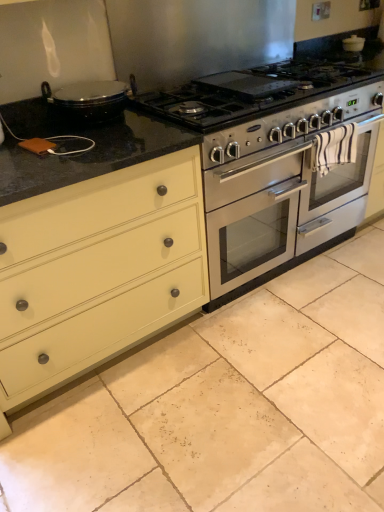
Where is `stainless steel oven at center`? This screenshot has height=512, width=384. stainless steel oven at center is located at coordinates (281, 208).

Measure the distance between matte cream drawer at left and camera.

They are 1.22 meters apart.

The width and height of the screenshot is (384, 512). What are the coordinates of `beige matte tile at center` in the screenshot? It's located at (227, 406).

Is matte cream drawer at left looking in the opposite direction of satin silver gas stove at center?

No, satin silver gas stove at center is not at the back of matte cream drawer at left.

Considering the points (21, 304) and (321, 91), which point is in front, point (21, 304) or point (321, 91)?

The point (21, 304) is in front.

From a real-world perspective, which object stands above the other?

satin silver gas stove at center.

Choose the correct answer: Is matte cream drawer at left inside satin silver gas stove at center or outside it?

matte cream drawer at left exists outside the volume of satin silver gas stove at center.

From the image's perspective, is satin silver gas stove at center above or below beige matte tile at center?

satin silver gas stove at center is above beige matte tile at center.

Is satin silver gas stove at center at the right side of beige matte tile at center?

No.

Which object is thinner, satin silver gas stove at center or beige matte tile at center?

With smaller width is satin silver gas stove at center.

Which is closer, (281, 89) or (377, 319)?

Point (281, 89).

You are a GUI agent. You are given a task and a screenshot of the screen. Output one action in this format:
    pyautogui.click(x=<x>, y=<y>)
    Task: Click on the ceramic tile on the right of matte cream drawer at left
    The width and height of the screenshot is (384, 512).
    Given the screenshot: What is the action you would take?
    pyautogui.click(x=227, y=406)

Is beige matte tile at center taller than matte cream drawer at left?

Incorrect, the height of beige matte tile at center is not larger of that of matte cream drawer at left.

Which is in front, point (234, 315) or point (0, 261)?

The point (0, 261) is closer to the camera.

From a real-world perspective, between beige matte tile at center and matte cream drawer at left, who is vertically lower?

beige matte tile at center is physically lower.

From the picture: Considering the positions of objects beige matte tile at center and stainless steel oven at center in the image provided, who is more to the right, beige matte tile at center or stainless steel oven at center?

Positioned to the right is beige matte tile at center.

Could you tell me if beige matte tile at center is turned towards stainless steel oven at center?

No.

Is beige matte tile at center positioned beyond the bounds of stainless steel oven at center?

Absolutely, beige matte tile at center is external to stainless steel oven at center.

How much distance is there between beige matte tile at center and stainless steel oven at center?

A distance of 21.95 inches exists between beige matte tile at center and stainless steel oven at center.

How far apart are satin silver gas stove at center and stainless steel oven at center?

satin silver gas stove at center and stainless steel oven at center are 13.98 inches apart.

Between satin silver gas stove at center and stainless steel oven at center, which one has less height?

satin silver gas stove at center.

Is satin silver gas stove at center positioned far away from stainless steel oven at center?

No, satin silver gas stove at center is not far away from stainless steel oven at center.

Which is closer, (314,240) or (91,437)?

Point (314,240).

Considering the relative positions of stainless steel oven at center and beige matte tile at center in the image provided, is stainless steel oven at center to the left of beige matte tile at center from the viewer's perspective?

Yes.

Considering the relative sizes of stainless steel oven at center and beige matte tile at center in the image provided, is stainless steel oven at center bigger than beige matte tile at center?

Indeed, stainless steel oven at center has a larger size compared to beige matte tile at center.

Between beige matte tile at center and satin silver gas stove at center, which one is positioned behind?

satin silver gas stove at center is behind.

Would you say beige matte tile at center is a long distance from satin silver gas stove at center?

That's right, there is a large distance between beige matte tile at center and satin silver gas stove at center.

In terms of height, does beige matte tile at center look taller or shorter compared to satin silver gas stove at center?

beige matte tile at center is shorter than satin silver gas stove at center.

Can you confirm if beige matte tile at center is positioned to the left of satin silver gas stove at center?

No, beige matte tile at center is not to the left of satin silver gas stove at center.

The image size is (384, 512). In order to click on chest of drawers to the left of satin silver gas stove at center in this screenshot , I will do (98, 272).

Find the location of a particular element. gas stove located above the beige matte tile at center (from a real-world perspective) is located at coordinates (257, 91).

Based on their spatial positions, is stainless steel oven at center or matte cream drawer at left closer to satin silver gas stove at center?

stainless steel oven at center is positioned closer to the anchor satin silver gas stove at center.

In the scene shown: Based on their spatial positions, is satin silver gas stove at center or stainless steel oven at center further from beige matte tile at center?

satin silver gas stove at center lies further to beige matte tile at center than the other object.

Based on their spatial positions, is beige matte tile at center or satin silver gas stove at center further from matte cream drawer at left?

satin silver gas stove at center lies further to matte cream drawer at left than the other object.

Looking at the image, which one is located closer to matte cream drawer at left, satin silver gas stove at center or stainless steel oven at center?

Based on the image, stainless steel oven at center appears to be nearer to matte cream drawer at left.

Based on their spatial positions, is stainless steel oven at center or matte cream drawer at left further from beige matte tile at center?

Among the two, stainless steel oven at center is located further to beige matte tile at center.

Looking at the image, which one is located further to stainless steel oven at center, matte cream drawer at left or satin silver gas stove at center?

matte cream drawer at left lies further to stainless steel oven at center than the other object.

Considering their positions, is matte cream drawer at left positioned further to satin silver gas stove at center than beige matte tile at center?

beige matte tile at center is further to satin silver gas stove at center.

When comparing their distances from satin silver gas stove at center, does stainless steel oven at center or beige matte tile at center seem further?

Based on the image, beige matte tile at center appears to be further to satin silver gas stove at center.

Find the location of a particular element. Image resolution: width=384 pixels, height=512 pixels. gas stove between matte cream drawer at left and stainless steel oven at center from left to right is located at coordinates (257, 91).

Where is `oven between matte cream drawer at left and beige matte tile at center`? This screenshot has width=384, height=512. oven between matte cream drawer at left and beige matte tile at center is located at coordinates (281, 208).

Identify the location of oven between satin silver gas stove at center and beige matte tile at center from top to bottom. (281, 208).

Identify the location of the chest of drawers that lies between satin silver gas stove at center and beige matte tile at center from top to bottom. The width and height of the screenshot is (384, 512). (98, 272).